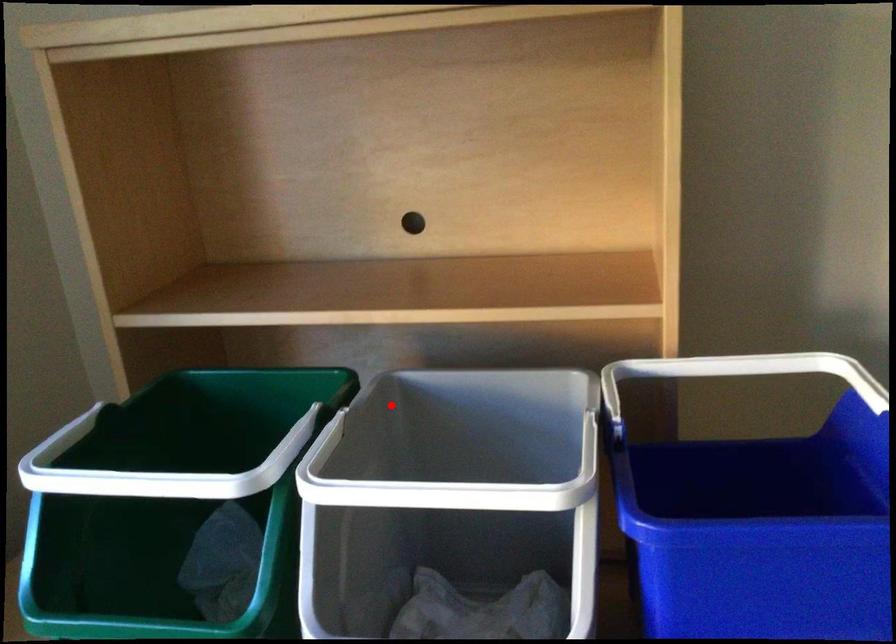
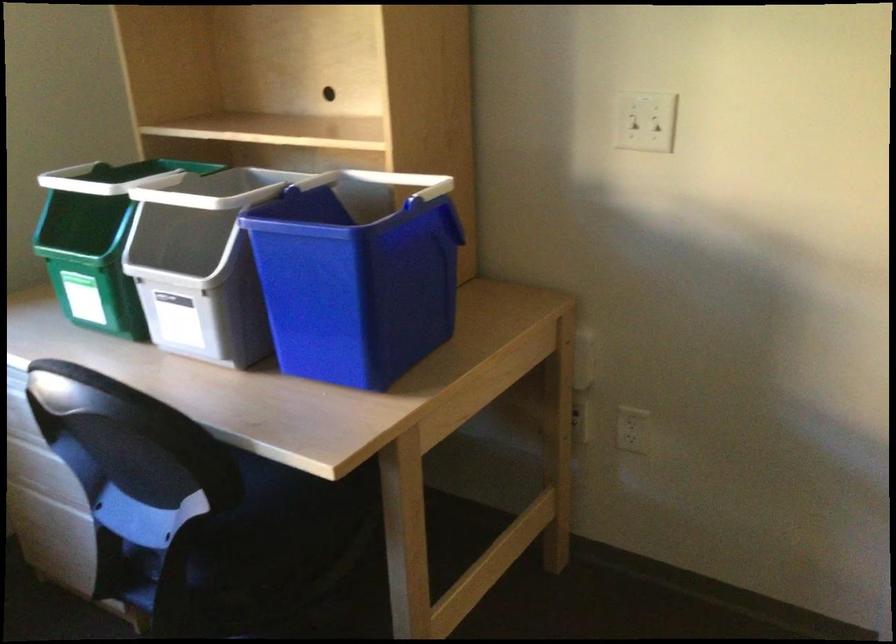
Locate, in the second image, the point that corresponds to the highlighted location in the first image.

(245, 185)